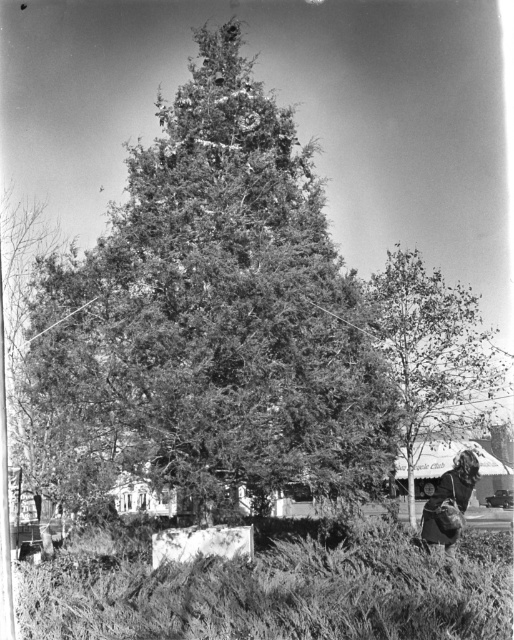
Between green textured pine tree at center and smooth green tree at right, which one is positioned lower?

smooth green tree at right is below.

Is point (40, 285) in front of point (394, 333)?

Yes, it is in front of point (394, 333).

Find the location of `green textured pine tree at center`. green textured pine tree at center is located at coordinates (213, 314).

In the scene shown: How distant is smooth green tree at right from dark hair at lower right?

A distance of 38.35 feet exists between smooth green tree at right and dark hair at lower right.

Is smooth green tree at right wider than dark hair at lower right?

Incorrect, smooth green tree at right's width does not surpass dark hair at lower right's.

Is point (431, 276) less distant than point (438, 486)?

No, (431, 276) is further to viewer.

Image resolution: width=514 pixels, height=640 pixels. Find the location of `smooth green tree at right`. smooth green tree at right is located at coordinates (433, 355).

Is the position of green textured pine tree at center less distant than that of dark hair at lower right?

Yes, green textured pine tree at center is closer to the viewer.

Does point (201, 381) come closer to viewer compared to point (443, 545)?

Yes, point (201, 381) is in front of point (443, 545).

Who is more forward, (324, 340) or (454, 531)?

Point (454, 531) is in front.

Find the location of a particular element. This screenshot has width=514, height=640. green textured pine tree at center is located at coordinates (213, 314).